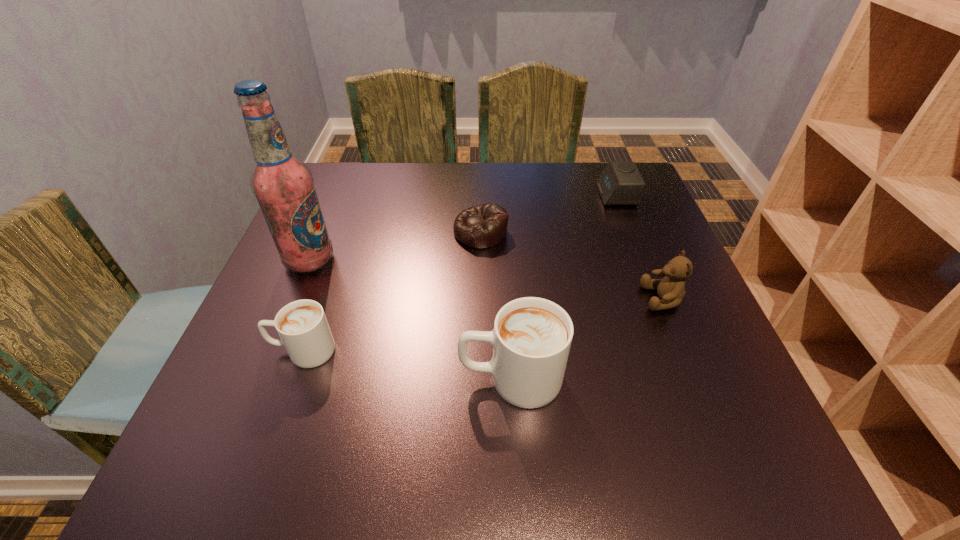
At what (x,y) coordinates should I click in order to perform the action: click on free space between the right cappuccino and the alcohol. Please return your answer as a coordinate pair (x, y). Looking at the image, I should click on (410, 319).

Where is `vacant space in between the fourth shortest object and the taller cappuccino`? This screenshot has width=960, height=540. vacant space in between the fourth shortest object and the taller cappuccino is located at coordinates (587, 338).

Where is `free space between the fifth tallest object and the beanbag`? This screenshot has height=540, width=960. free space between the fifth tallest object and the beanbag is located at coordinates (548, 213).

You are a GUI agent. You are given a task and a screenshot of the screen. Output one action in this format:
    pyautogui.click(x=<x>, y=<y>)
    Task: Click on the empty space that is in between the alarm clock and the beanbag
    The height and width of the screenshot is (540, 960).
    Given the screenshot: What is the action you would take?
    pyautogui.click(x=548, y=213)

Locate an element on the screen. The width and height of the screenshot is (960, 540). object that is the fourth closest to the fourth tallest object is located at coordinates (671, 289).

Select which object appears as the second closest to the tallest object. Please provide its 2D coordinates. Your answer should be formatted as a tuple, i.e. [(x, y)], where the tuple contains the x and y coordinates of a point satisfying the conditions above.

[(482, 226)]

At what (x,y) coordinates should I click in order to perform the action: click on free location that satisfies the following two spatial constraints: 1. on the front-facing side of the farthest object; 2. on the front side of the shortest object. Please return your answer as a coordinate pair (x, y). The height and width of the screenshot is (540, 960). Looking at the image, I should click on (631, 232).